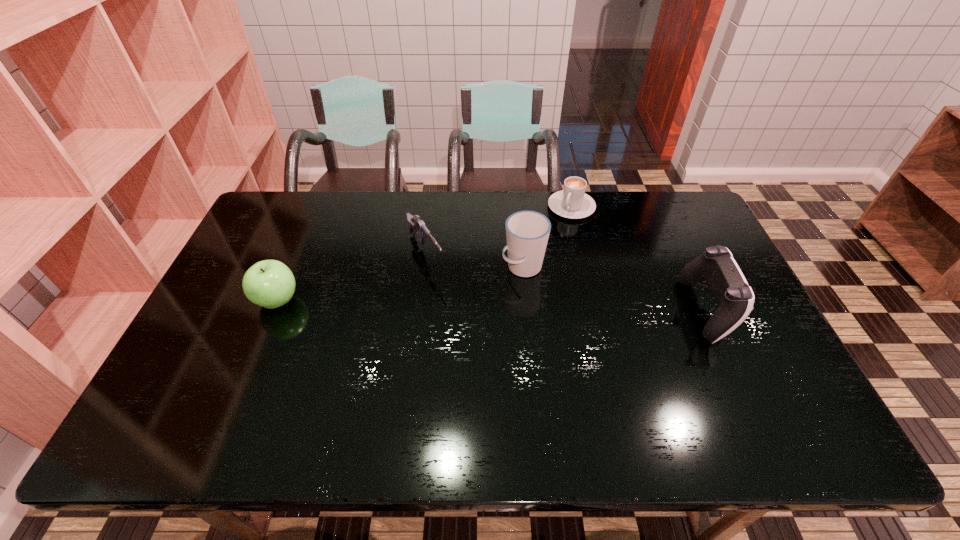
Where is `free point that satisfies the following two spatial constraints: 1. on the back side of the shortest object; 2. on the right side of the apple`? This screenshot has height=540, width=960. free point that satisfies the following two spatial constraints: 1. on the back side of the shortest object; 2. on the right side of the apple is located at coordinates (317, 207).

In order to click on free space that satisfies the following two spatial constraints: 1. on the front side of the third object from right to left; 2. on the left side of the gun in this screenshot , I will do `click(424, 267)`.